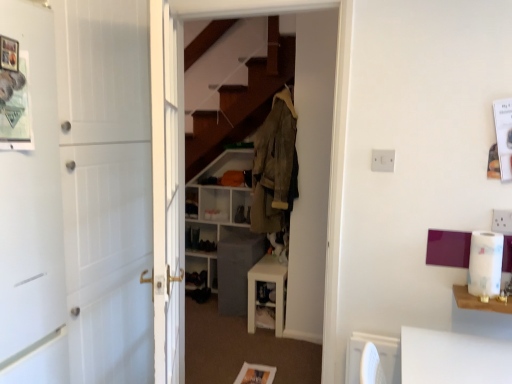
Question: From the image's perspective, relative to white plastic table at right, is wooden dresser at center above or below?

Choices:
 (A) below
 (B) above

Answer: (B)

Question: Which is correct: wooden dresser at center is inside white plastic table at right, or outside of it?

Choices:
 (A) outside
 (B) inside

Answer: (A)

Question: Estimate the real-world distances between objects in this image. Which object is farther from the white glossy cabinet at center?

Choices:
 (A) white plastic table at right
 (B) camouflage fabric jacket at center
 (C) wooden dresser at center
 (D) white plastic shelf at center, which ranks as the second shelf in top-to-bottom order
 (E) dark gray fabric shoe at center

Answer: (A)

Question: Considering the real-world distances, which object is closest to the camouflage fabric jacket at center?

Choices:
 (A) white plastic table at right
 (B) wooden dresser at center
 (C) white plastic shelf at center, which ranks as the second shelf in top-to-bottom order
 (D) white wood door at left
 (E) white glossy cabinet at center

Answer: (B)